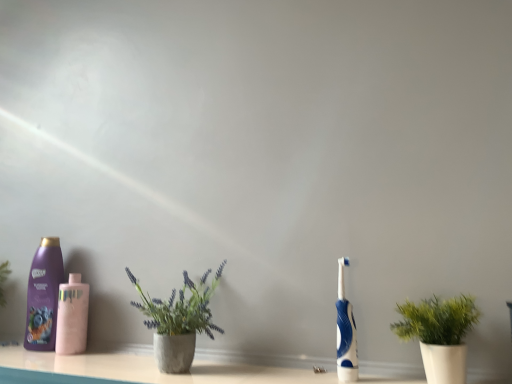
Question: From a real-world perspective, relative to blue rubber toothbrush at right, is purple glossy shampoo at left, the first bottle positioned from the left, vertically above or below?

Choices:
 (A) above
 (B) below

Answer: (A)

Question: Considering the positions of purple glossy shampoo at left, the first bottle positioned from the left, and blue rubber toothbrush at right in the image, is purple glossy shampoo at left, the first bottle positioned from the left, taller or shorter than blue rubber toothbrush at right?

Choices:
 (A) short
 (B) tall

Answer: (B)

Question: Considering the real-world distances, which object is closest to the concrete textured pot at center, which ranks as the second houseplant in right-to-left order?

Choices:
 (A) pink matte bottle at left, the second bottle positioned from the left
 (B) green matte plant at right, the 2th houseplant when ordered from left to right
 (C) purple glossy shampoo at left, which appears as the second bottle when viewed from the right
 (D) blue rubber toothbrush at right

Answer: (A)

Question: Estimate the real-world distances between objects in this image. Which object is farther from the blue rubber toothbrush at right?

Choices:
 (A) concrete textured pot at center, the first houseplant when ordered from left to right
 (B) green matte plant at right, the 2th houseplant when ordered from left to right
 (C) purple glossy shampoo at left, the first bottle positioned from the left
 (D) pink matte bottle at left, the second bottle positioned from the left

Answer: (C)